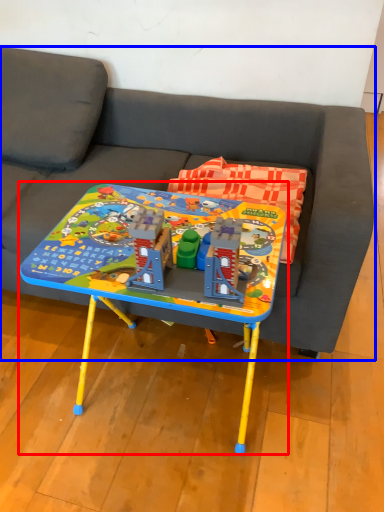
Question: Which object is closer to the camera taking this photo, table (highlighted by a red box) or studio couch (highlighted by a blue box)?

Choices:
 (A) table
 (B) studio couch

Answer: (A)